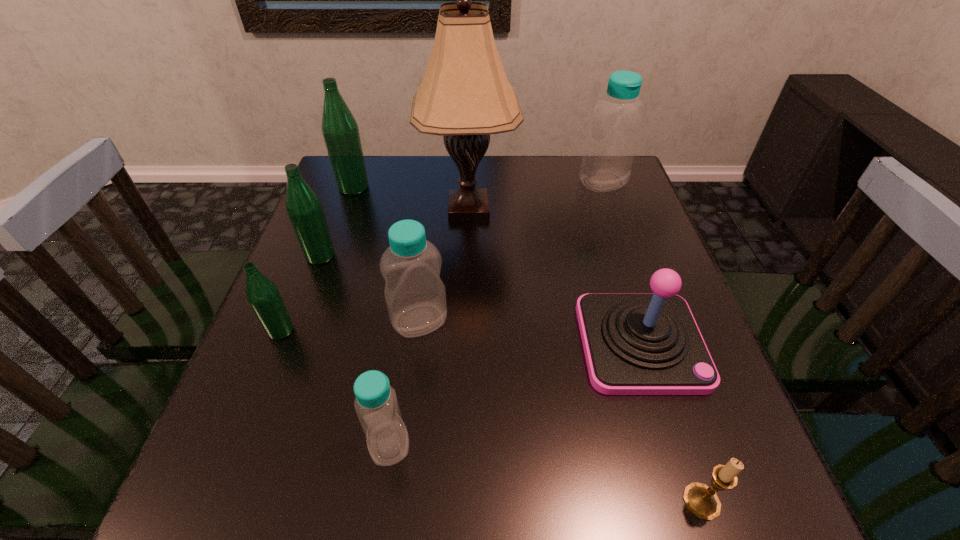
This screenshot has width=960, height=540. In order to click on object at the far right corner in this screenshot , I will do `click(612, 140)`.

You are a GUI agent. You are given a task and a screenshot of the screen. Output one action in this format:
    pyautogui.click(x=<x>, y=<y>)
    Task: Click on the object present at the near right corner
    The width and height of the screenshot is (960, 540).
    Given the screenshot: What is the action you would take?
    pyautogui.click(x=702, y=501)

Identify the location of blank space at the far edge of the desktop. (444, 164).

In the image, there is a desktop. Identify the location of vacant space at the near edge. The height and width of the screenshot is (540, 960). (311, 464).

Identify the location of vacant area at the left edge. (315, 428).

The height and width of the screenshot is (540, 960). What are the coordinates of `vacant space at the far left corner of the desktop` in the screenshot? It's located at (372, 157).

At what (x,y) coordinates should I click in order to perform the action: click on vacant space at the far right corner of the desktop. Please return your answer as a coordinate pair (x, y). Looking at the image, I should click on (618, 194).

This screenshot has height=540, width=960. Identify the location of vacant area that lies between the pink joystick and the second smallest green bottle. (481, 299).

This screenshot has width=960, height=540. What are the coordinates of `free space between the smallest blue bottle and the smallest green bottle` in the screenshot? It's located at (335, 387).

The width and height of the screenshot is (960, 540). In order to click on free area in between the joystick and the rightmost bottle in this screenshot , I will do `click(622, 262)`.